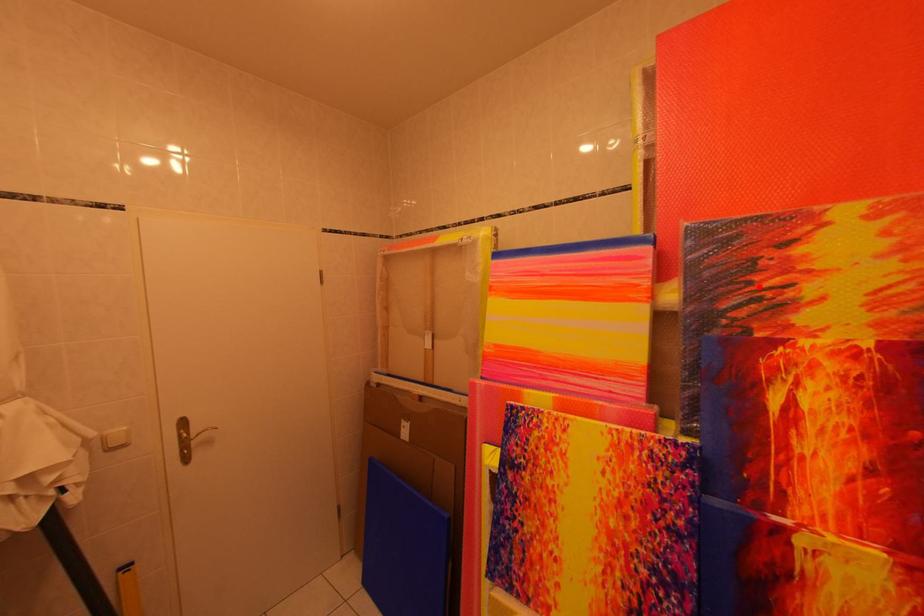
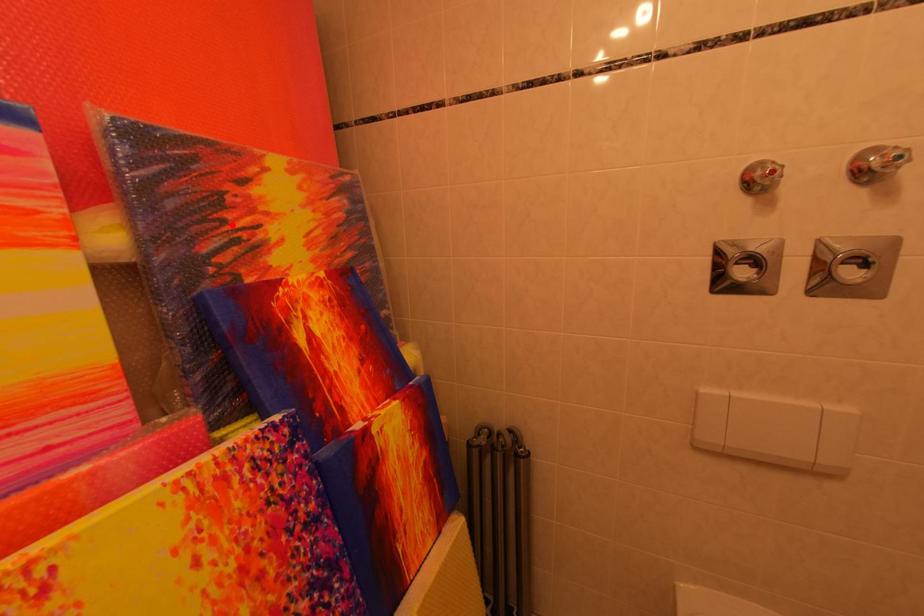
I am providing you with two images of the same scene from different viewpoints. A red point is marked on the first image and another point is marked on the second image. Does the point marked in image1 correspond to the same location as the one in image2?

Yes